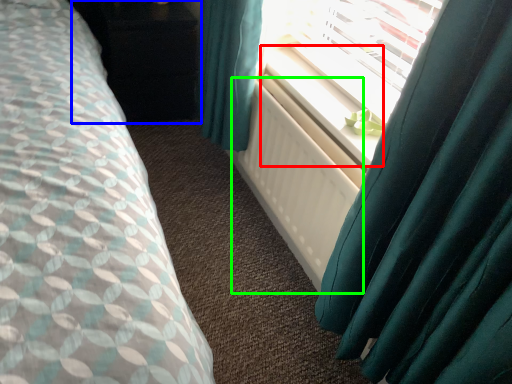
Question: Which object is positioned closest to window sill (highlighted by a red box)? Select from dresser (highlighted by a blue box) and radiator (highlighted by a green box).

Choices:
 (A) dresser
 (B) radiator

Answer: (B)